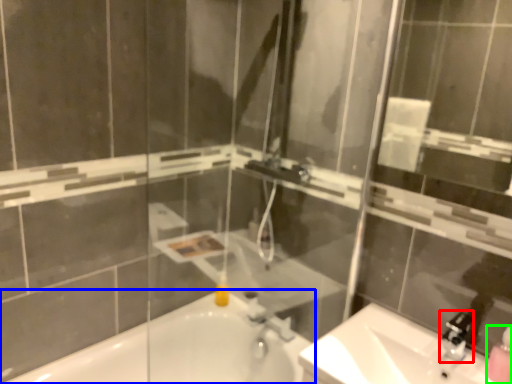
Question: Estimate the real-world distances between objects in this image. Which object is farther from faucet (highlighted by a red box), bathtub (highlighted by a blue box) or soap dispenser (highlighted by a green box)?

Choices:
 (A) bathtub
 (B) soap dispenser

Answer: (A)